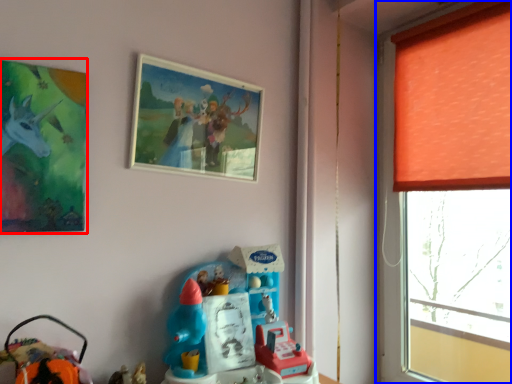
Question: Which point is closer to the camera, picture frame (highlighted by a red box) or window (highlighted by a blue box)?

Choices:
 (A) picture frame
 (B) window

Answer: (A)